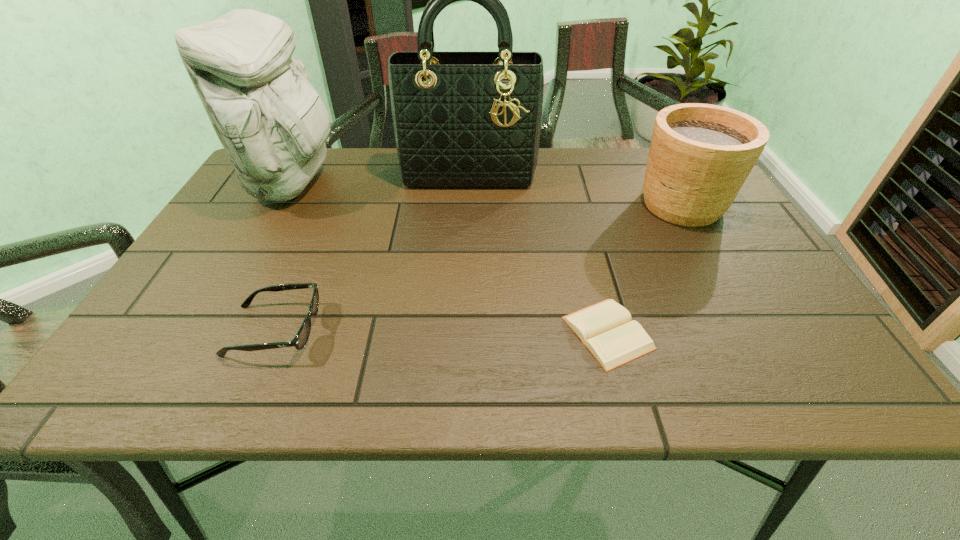
What are the coordinates of `vacant space located on the lenses of the spectacles` in the screenshot? It's located at (344, 330).

Locate an element on the screen. The image size is (960, 540). free space located on the left of the diary is located at coordinates (408, 333).

Image resolution: width=960 pixels, height=540 pixels. Identify the location of handbag situated at the far edge. [466, 121].

You are a GUI agent. You are given a task and a screenshot of the screen. Output one action in this format:
    pyautogui.click(x=<x>, y=<y>)
    Task: Click on the backpack that is at the far edge
    This screenshot has height=540, width=960.
    Given the screenshot: What is the action you would take?
    pyautogui.click(x=271, y=121)

Where is `flowerpot at the far edge`? The image size is (960, 540). flowerpot at the far edge is located at coordinates (700, 155).

Where is `spectacles at the near edge`? spectacles at the near edge is located at coordinates (299, 341).

This screenshot has width=960, height=540. In order to click on diary that is at the near edge in this screenshot , I will do `click(605, 328)`.

This screenshot has height=540, width=960. I want to click on object present at the left edge, so click(x=271, y=121).

Locate an element on the screen. object that is positioned at the right edge is located at coordinates (700, 155).

The image size is (960, 540). I want to click on object that is positioned at the far left corner, so click(271, 121).